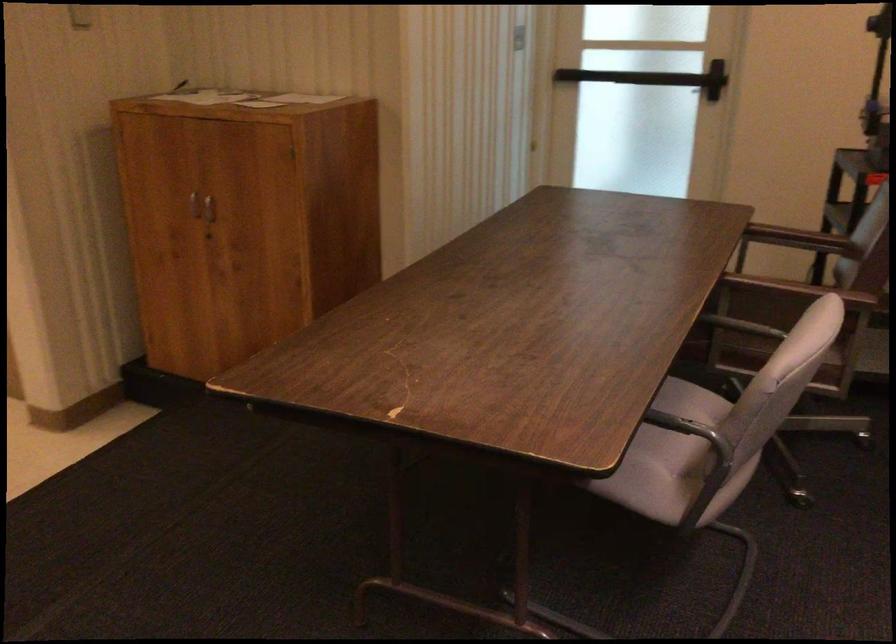
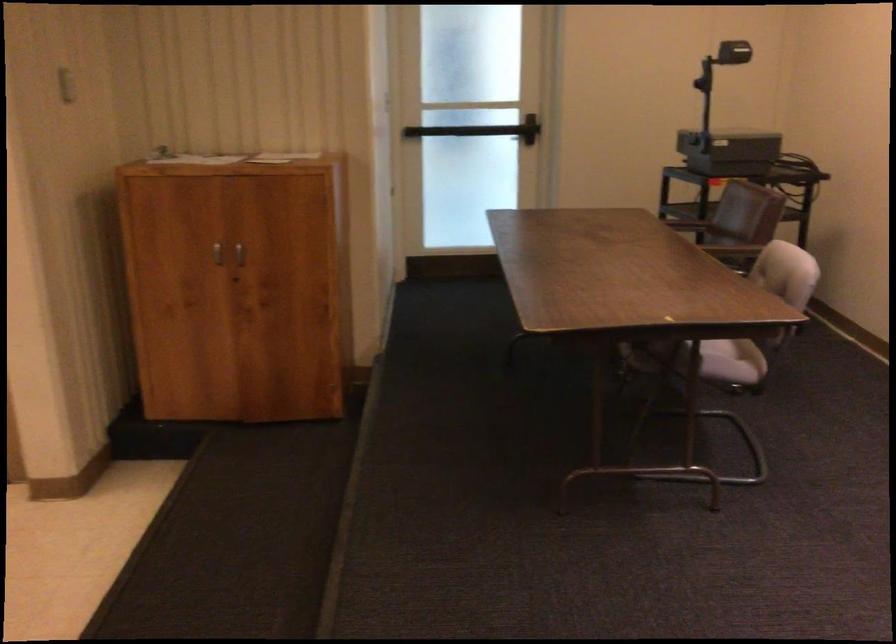
Question: The images are taken continuously from a first-person perspective. In which direction are you moving?

Choices:
 (A) Left
 (B) Right
 (C) Forward
 (D) Backward

Answer: (A)